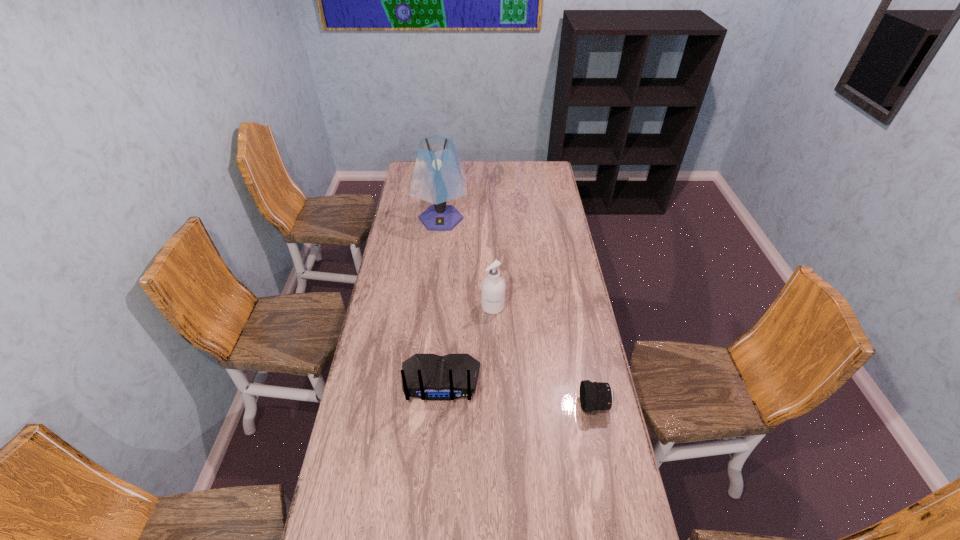
In order to click on free space between the router and the telephoto lens in this screenshot , I will do `click(517, 393)`.

Locate an element on the screen. object that is the third closest to the telephoto lens is located at coordinates (438, 176).

Select which object appears as the second closest to the third tallest object. Please provide its 2D coordinates. Your answer should be formatted as a tuple, i.e. [(x, y)], where the tuple contains the x and y coordinates of a point satisfying the conditions above.

[(594, 396)]